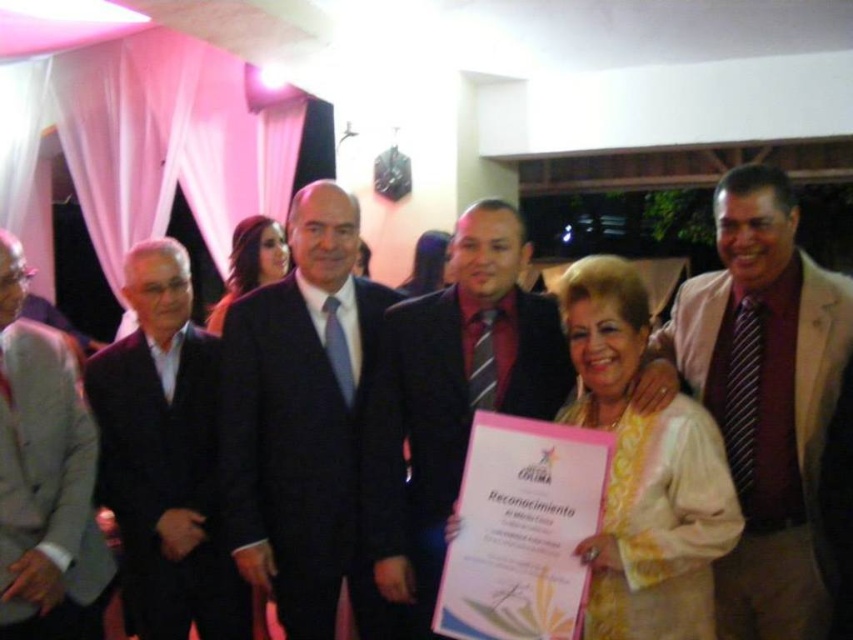
Question: Which object is farther from the camera taking this photo?

Choices:
 (A) gray wool suit at left
 (B) matte gold necklace at center
 (C) beige textured suit at right

Answer: (B)

Question: Which of the following is the closest to the observer?

Choices:
 (A) beige textured suit at right
 (B) gray wool suit at left

Answer: (A)

Question: Is yellow satin blouse at center above shiny dark hair at center?

Choices:
 (A) no
 (B) yes

Answer: (A)

Question: Which of the following is the closest to the observer?

Choices:
 (A) shiny dark hair at center
 (B) gray wool suit at left

Answer: (B)

Question: Considering the relative positions of beige textured suit at right and matte gold necklace at center in the image provided, where is beige textured suit at right located with respect to matte gold necklace at center?

Choices:
 (A) above
 (B) below

Answer: (B)

Question: Does black suit at left come in front of gray wool suit at left?

Choices:
 (A) yes
 (B) no

Answer: (B)